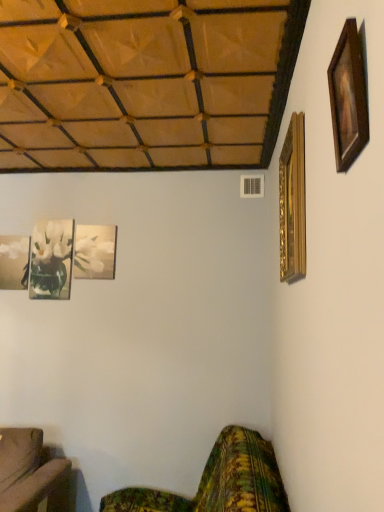
Question: From the image's perspective, is wooden picture frame at upper right, the fifth picture frame positioned from the back, on green floral fabric couch at lower right?

Choices:
 (A) yes
 (B) no

Answer: (A)

Question: From a real-world perspective, does wooden picture frame at upper right, which is counted as the fourth picture frame, starting from the left, stand above green floral fabric couch at lower right?

Choices:
 (A) no
 (B) yes

Answer: (B)

Question: Are wooden picture frame at upper right, the fifth picture frame positioned from the back, and green floral fabric couch at lower right making contact?

Choices:
 (A) no
 (B) yes

Answer: (A)

Question: Considering the relative sizes of wooden picture frame at upper right, the fifth picture frame positioned from the back, and green floral fabric couch at lower right in the image provided, is wooden picture frame at upper right, the fifth picture frame positioned from the back, shorter than green floral fabric couch at lower right?

Choices:
 (A) yes
 (B) no

Answer: (A)

Question: Is wooden picture frame at upper right, the fifth picture frame positioned from the back, far from green floral fabric couch at lower right?

Choices:
 (A) yes
 (B) no

Answer: (A)

Question: From the image's perspective, is gold ornate picture frame at upper right, the second picture frame positioned from the front, above or below green floral fabric couch at lower right?

Choices:
 (A) below
 (B) above

Answer: (B)

Question: Looking at the image, does gold ornate picture frame at upper right, acting as the 5th picture frame starting from the left, seem bigger or smaller compared to green floral fabric couch at lower right?

Choices:
 (A) big
 (B) small

Answer: (B)

Question: From a real-world perspective, relative to green floral fabric couch at lower right, is gold ornate picture frame at upper right, the first picture frame positioned from the right, vertically above or below?

Choices:
 (A) above
 (B) below

Answer: (A)

Question: Relative to green floral fabric couch at lower right, is gold ornate picture frame at upper right, acting as the 5th picture frame starting from the left, in front or behind?

Choices:
 (A) behind
 (B) front

Answer: (A)

Question: From a real-world perspective, is green floral fabric couch at lower right physically located above or below wooden picture frame at upper right, which is counted as the fourth picture frame, starting from the left?

Choices:
 (A) below
 (B) above

Answer: (A)

Question: Considering their positions, is green floral fabric couch at lower right located in front of or behind wooden picture frame at upper right, the fifth picture frame positioned from the back?

Choices:
 (A) front
 (B) behind

Answer: (B)

Question: From the image's perspective, is green floral fabric couch at lower right located above or below wooden picture frame at upper right, the second picture frame when ordered from right to left?

Choices:
 (A) below
 (B) above

Answer: (A)

Question: In terms of height, does green floral fabric couch at lower right look taller or shorter compared to wooden picture frame at upper right, arranged as the first picture frame when viewed from the front?

Choices:
 (A) tall
 (B) short

Answer: (A)

Question: Is green floral fabric couch at lower right to the left or to the right of matte glass picture frame at lower left, the 2th picture frame from the back, in the image?

Choices:
 (A) right
 (B) left

Answer: (A)

Question: Is green floral fabric couch at lower right inside the boundaries of matte glass picture frame at lower left, the 2th picture frame from the back, or outside?

Choices:
 (A) inside
 (B) outside

Answer: (B)